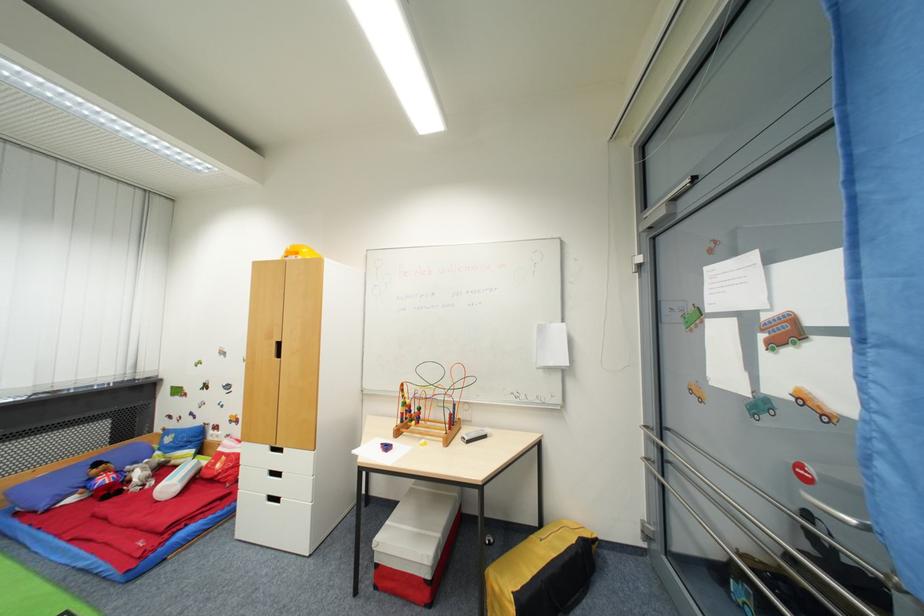
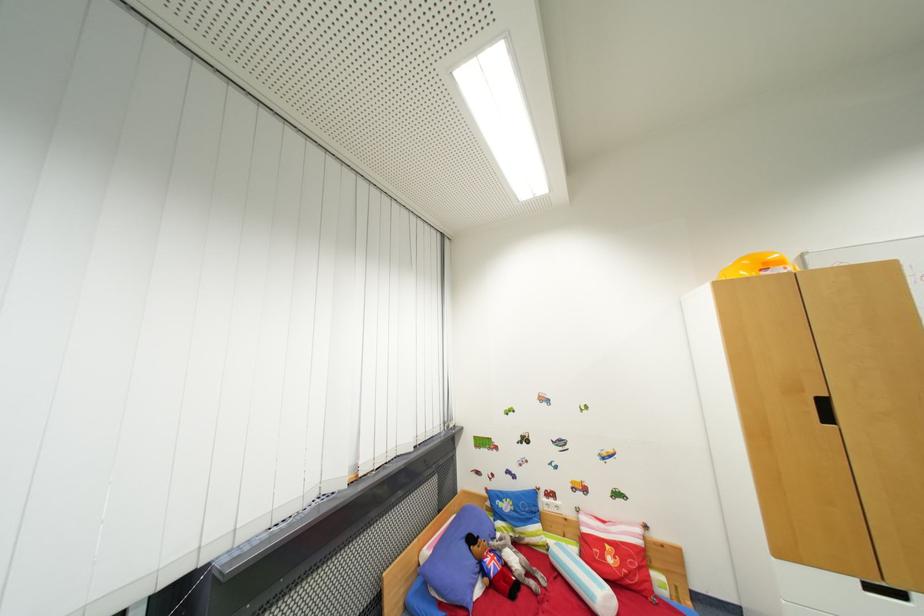
The point at (224, 468) is marked in the first image. Where is the corresponding point in the second image?

(614, 562)